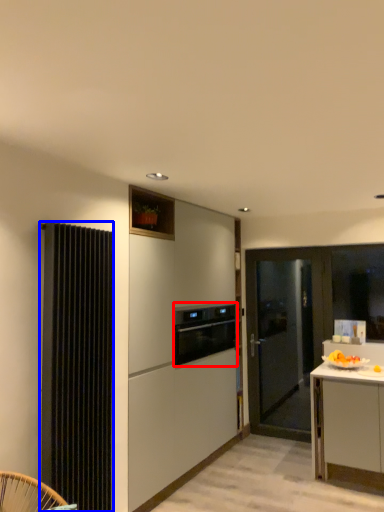
Question: Which point is further to the camera, kitchen appliance (highlighted by a red box) or radiator (highlighted by a blue box)?

Choices:
 (A) kitchen appliance
 (B) radiator

Answer: (A)